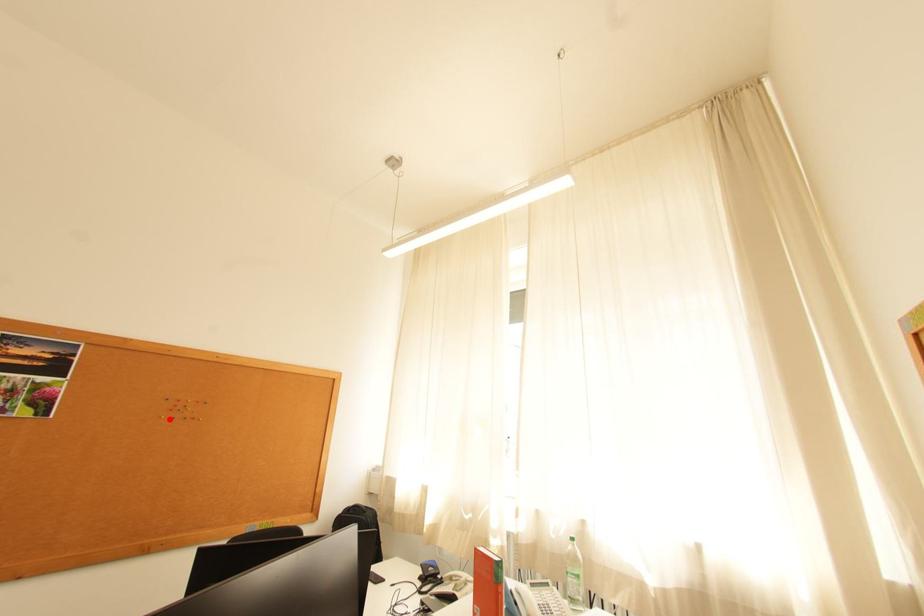
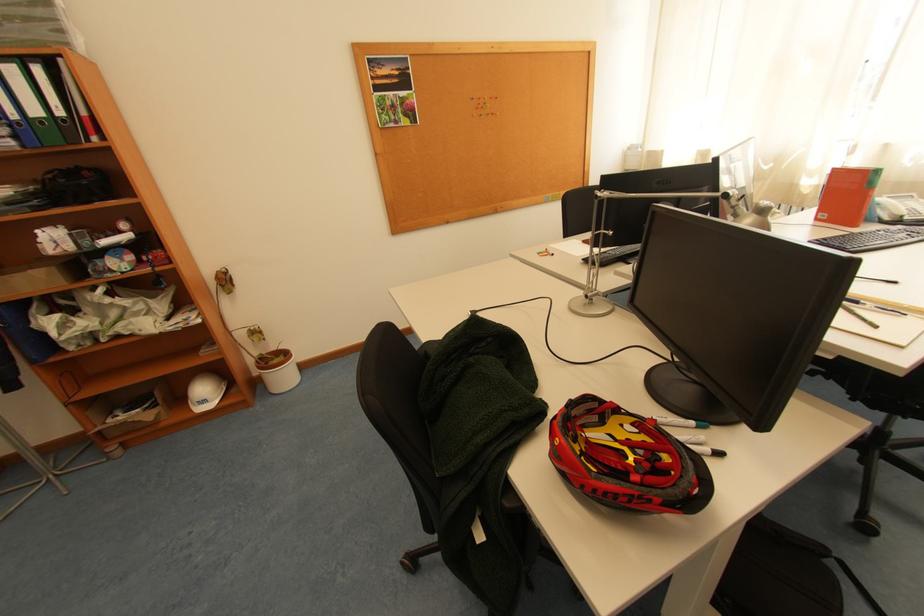
Question: I am providing you with two images of the same scene from different viewpoints. A red point is marked on the first image. At the location where the point appears in image 1, is it still visible in image 2?

Choices:
 (A) Yes
 (B) No

Answer: (A)